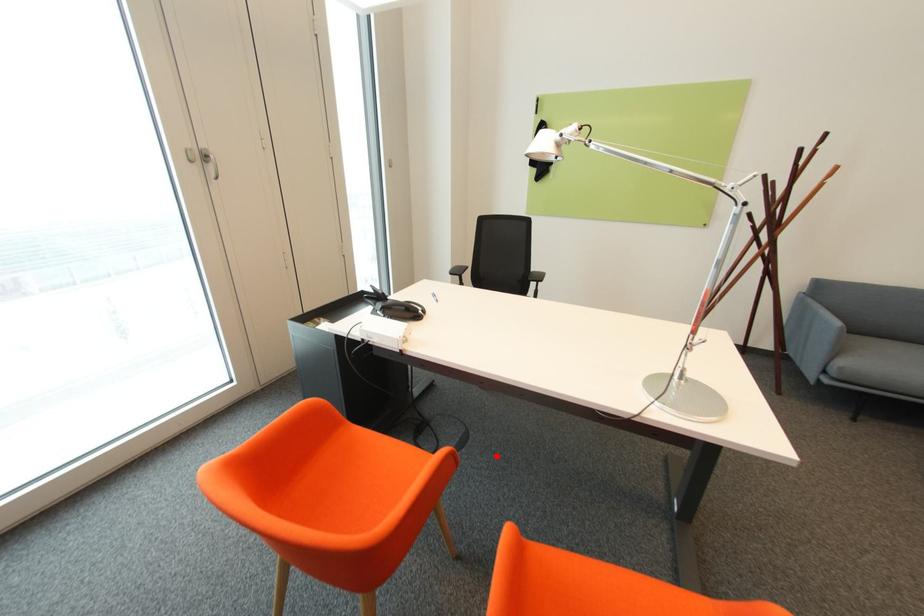
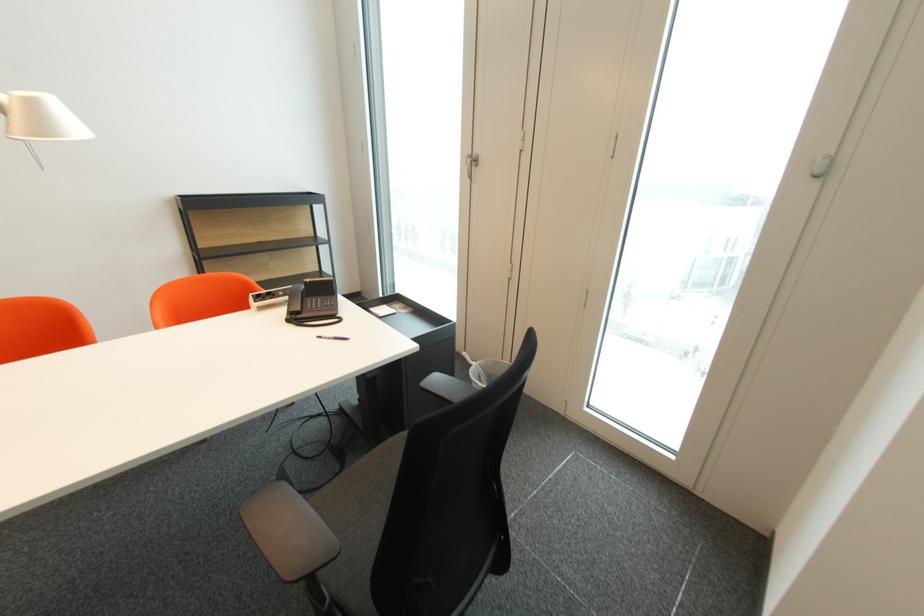
In the second image, find the point that corresponds to the highlighted location in the first image.

(248, 500)